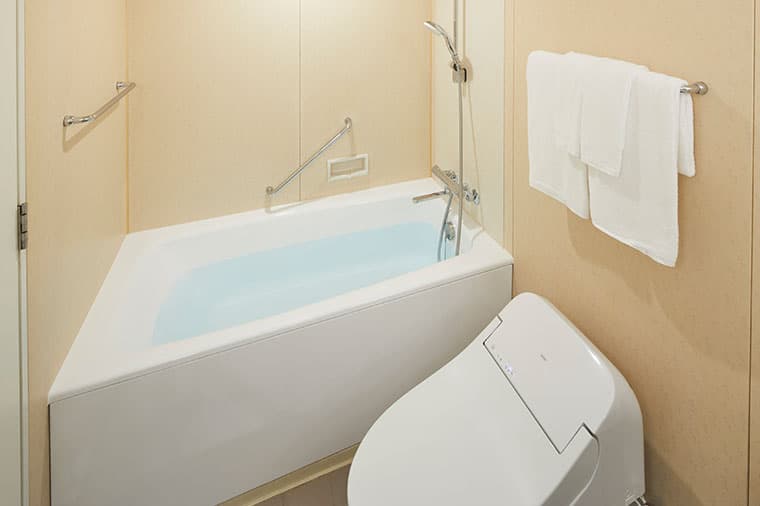
Find the location of `floor`. floor is located at coordinates (328, 492).